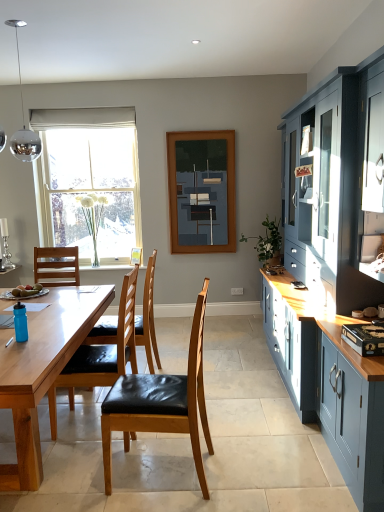
Find the location of a particular element. blank area beneath brown leather chair at center, which is counted as the 1th chair, starting from the front (from a real-world perspective) is located at coordinates (158, 469).